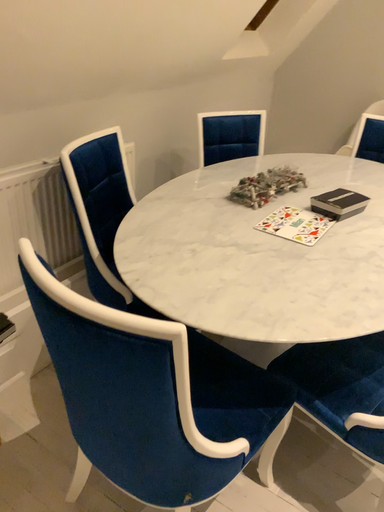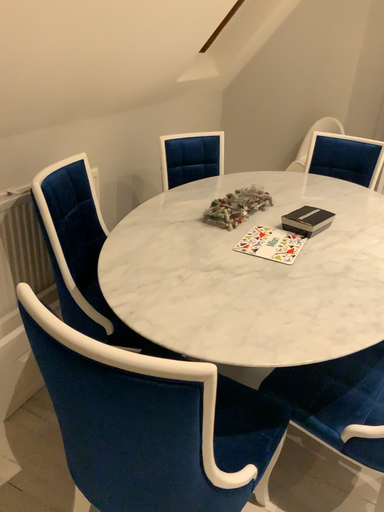
Question: Which way did the camera rotate in the video?

Choices:
 (A) rotated right
 (B) rotated left

Answer: (A)